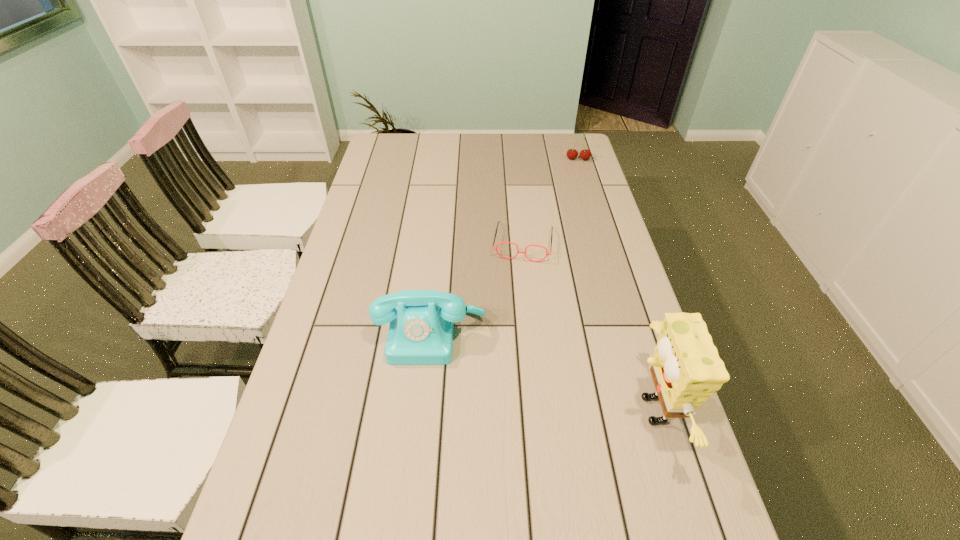
Locate an element on the screen. free spot on the desktop that is between the third shortest object and the sponge and is positioned on the front-facing side of the third nearest object is located at coordinates (508, 360).

Find the location of `vacant space on the desktop that is between the leftmost object and the sponge and is positioned on the surface of the cherry`. vacant space on the desktop that is between the leftmost object and the sponge and is positioned on the surface of the cherry is located at coordinates (565, 381).